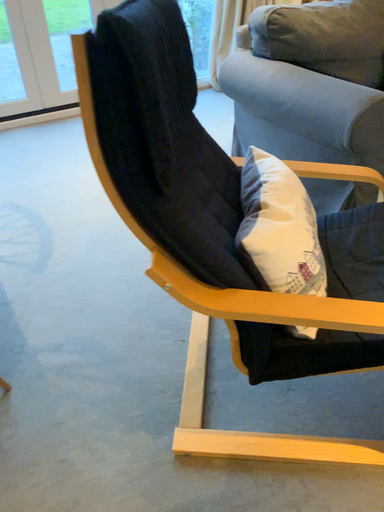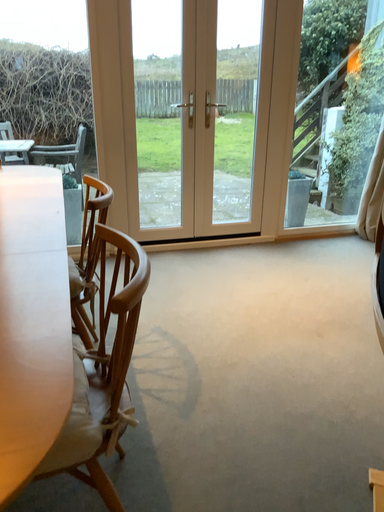
Question: Which way did the camera rotate in the video?

Choices:
 (A) rotated upward
 (B) rotated downward

Answer: (A)